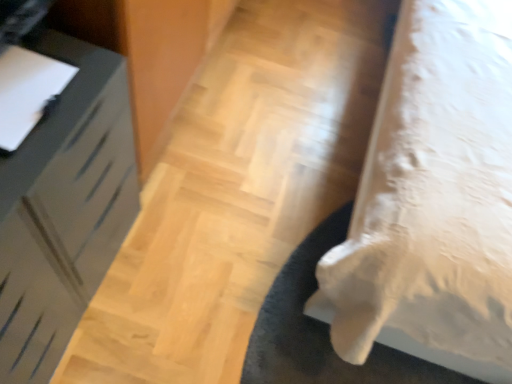
This screenshot has height=384, width=512. I want to click on blank area to the left of white fabric bed at lower right, the second furniture positioned from the left, so click(261, 92).